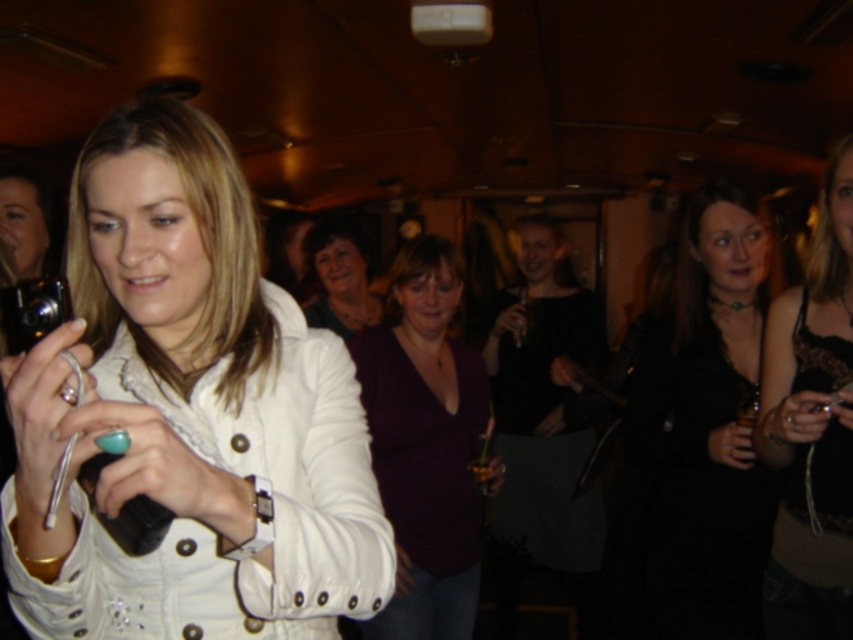
Is white leather jacket at center in front of matte black camera at left?

Yes.

Is point (250, 417) more distant than point (42, 236)?

No, it is in front of (42, 236).

Is point (84, 241) less distant than point (33, 250)?

Yes, point (84, 241) is closer to viewer.

Where is `white leather jacket at center`? The height and width of the screenshot is (640, 853). white leather jacket at center is located at coordinates (189, 413).

Does white leather jacket at center appear on the left side of black satin dress at center?

Indeed, white leather jacket at center is positioned on the left side of black satin dress at center.

Does white leather jacket at center have a greater width compared to black satin dress at center?

Yes, white leather jacket at center is wider than black satin dress at center.

Who is more forward, (357, 452) or (717, 252)?

Point (357, 452)

The width and height of the screenshot is (853, 640). What are the coordinates of `white leather jacket at center` in the screenshot? It's located at (189, 413).

Which is below, purple matte shirt at center or matte purple shirt at center?

purple matte shirt at center is lower down.

Who is positioned more to the left, purple matte shirt at center or matte purple shirt at center?

matte purple shirt at center

Is point (424, 506) closer to viewer compared to point (315, 260)?

Yes.

This screenshot has height=640, width=853. Find the location of `purple matte shirt at center`. purple matte shirt at center is located at coordinates (425, 444).